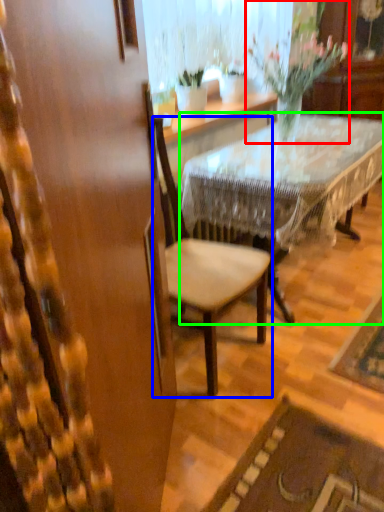
Question: Which object is the farthest from houseplant (highlighted by a red box)? Choose among these: chair (highlighted by a blue box) or desk (highlighted by a green box).

Choices:
 (A) chair
 (B) desk

Answer: (A)